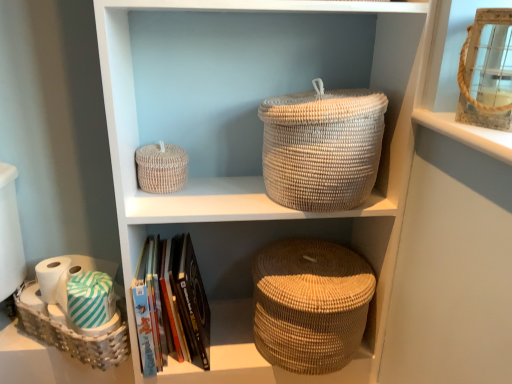
Identify the location of blank space above white woven basket at lower left, the first basket positioned from the bottom (from a real-world perspective). The width and height of the screenshot is (512, 384). (71, 301).